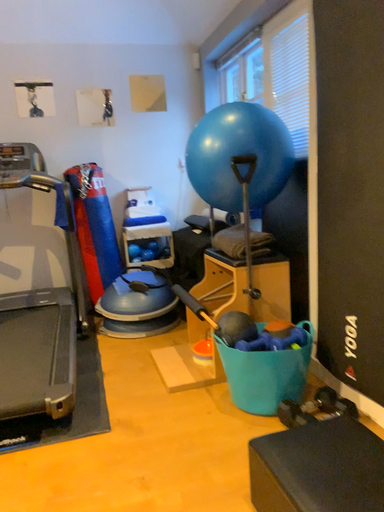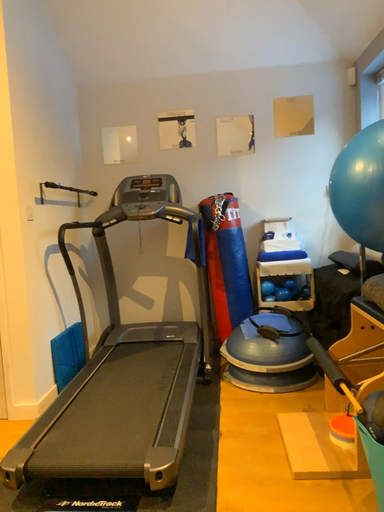
Question: How did the camera likely rotate when shooting the video?

Choices:
 (A) rotated left
 (B) rotated right

Answer: (A)